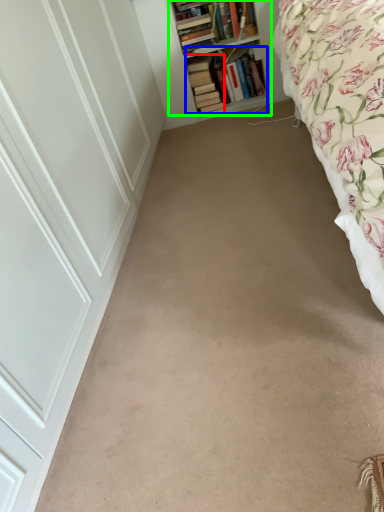
Question: Which object is positioned farthest from book (highlighted by a red box)? Select from book (highlighted by a blue box) and shelf (highlighted by a green box).

Choices:
 (A) book
 (B) shelf

Answer: (B)